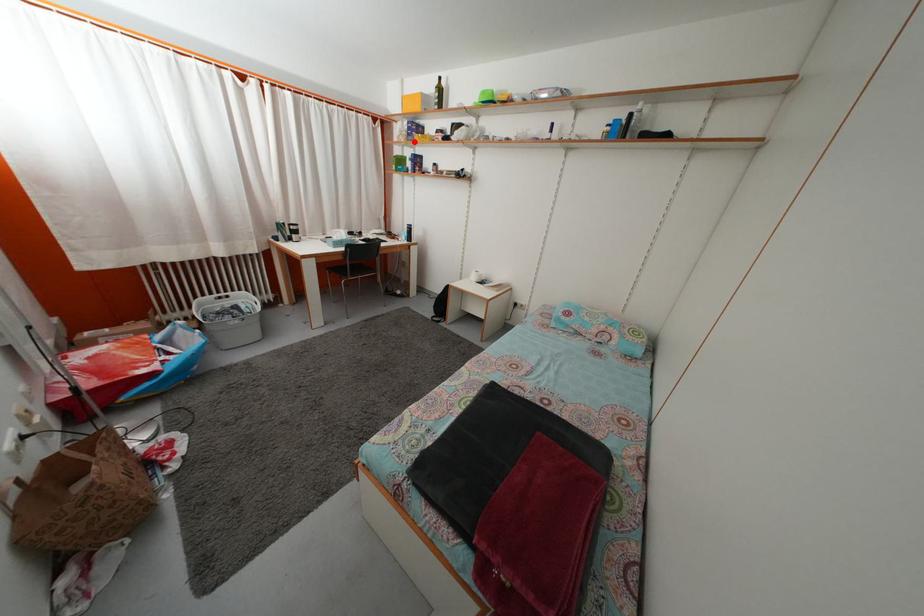
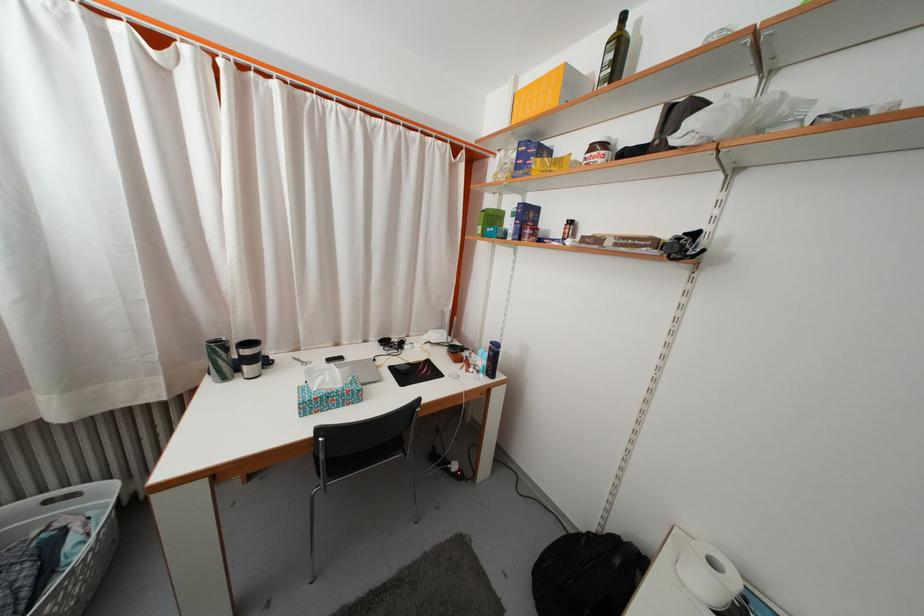
Find the pixel in the second image that matches the highlighted location in the first image.

(523, 175)